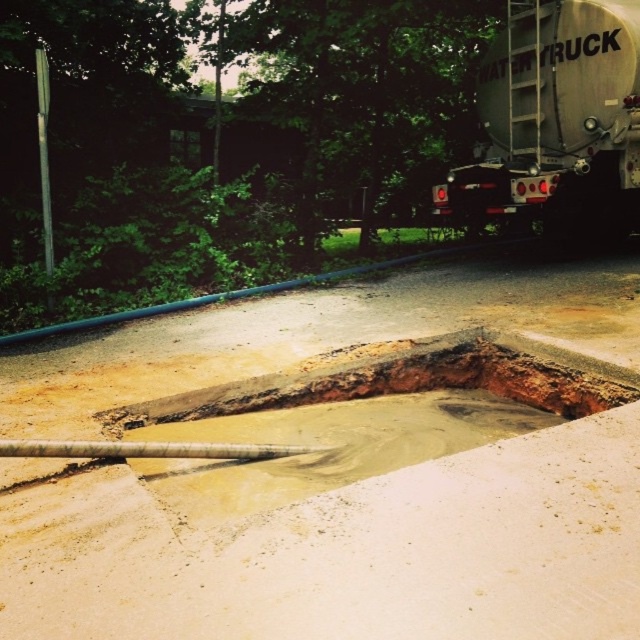
Between muddy concrete puddle at center and silver metallic trailer truck at upper right, which one has more height?

Standing taller between the two is silver metallic trailer truck at upper right.

The height and width of the screenshot is (640, 640). Describe the element at coordinates (364, 417) in the screenshot. I see `muddy concrete puddle at center` at that location.

The width and height of the screenshot is (640, 640). Identify the location of muddy concrete puddle at center. (364, 417).

The width and height of the screenshot is (640, 640). Identify the location of smooth concrete at center. (346, 552).

Does smooth concrete at center appear on the left side of muddy concrete puddle at center?

Yes, smooth concrete at center is to the left of muddy concrete puddle at center.

This screenshot has height=640, width=640. I want to click on smooth concrete at center, so pyautogui.click(x=346, y=552).

Is smooth concrete at center behind silver metallic trailer truck at upper right?

That is False.

Based on the photo, who is more forward, (340, 336) or (500, 161)?

Positioned in front is point (340, 336).

Image resolution: width=640 pixels, height=640 pixels. What do you see at coordinates (346, 552) in the screenshot? I see `smooth concrete at center` at bounding box center [346, 552].

You are a GUI agent. You are given a task and a screenshot of the screen. Output one action in this format:
    pyautogui.click(x=<x>, y=<y>)
    Task: Click on the smooth concrete at center
    The image size is (640, 640).
    Given the screenshot: What is the action you would take?
    click(346, 552)